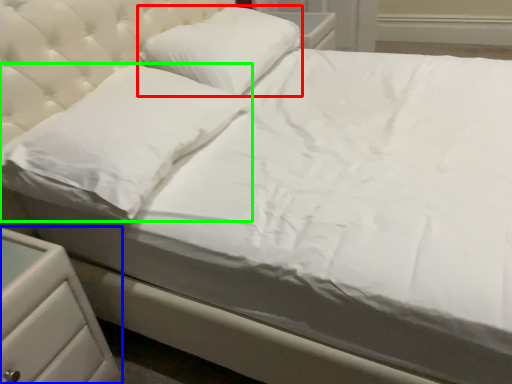
Question: Estimate the real-world distances between objects in this image. Which object is closer to pillow (highlighted by a red box), nightstand (highlighted by a blue box) or pillow (highlighted by a green box)?

Choices:
 (A) nightstand
 (B) pillow

Answer: (B)